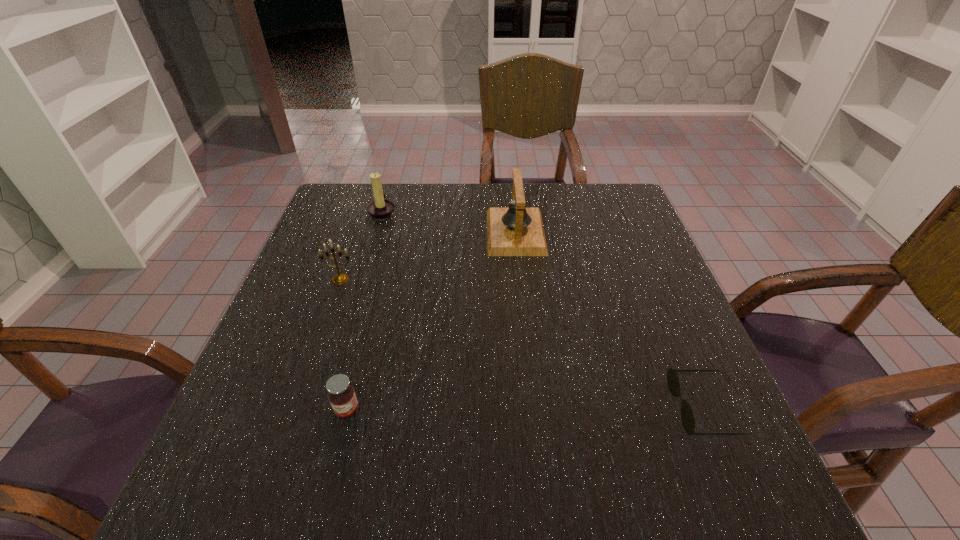
Find the location of a particular element. The image size is (960, 540). free space located on the front-facing side of the rightmost object is located at coordinates (477, 408).

I want to click on free space located 0.060m on the front-facing side of the rightmost object, so click(642, 408).

The width and height of the screenshot is (960, 540). Identify the location of vacant position located 0.180m on the front-facing side of the rightmost object. (576, 408).

Find the location of a particular element. Image resolution: width=960 pixels, height=540 pixels. bell located at the far edge is located at coordinates (515, 231).

I want to click on candle holder that is at the far edge, so click(x=380, y=209).

Identify the location of object present at the right edge. (673, 383).

Locate an element on the screen. The height and width of the screenshot is (540, 960). object present at the far left corner is located at coordinates (380, 209).

I want to click on vacant space at the far edge of the desktop, so click(x=451, y=198).

Locate an element on the screen. Image resolution: width=960 pixels, height=540 pixels. vacant space at the near edge is located at coordinates (358, 488).

Where is `blank space at the left edge of the desktop`? blank space at the left edge of the desktop is located at coordinates (311, 440).